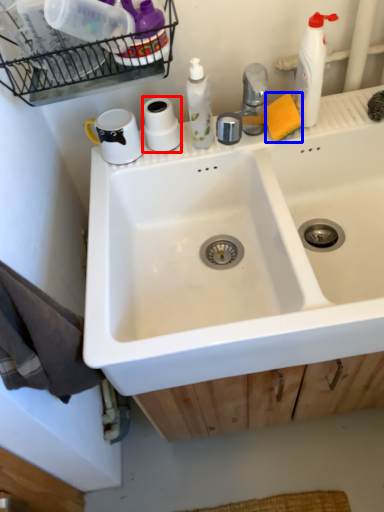
Question: Which object is closer to the camera taking this photo, toilet paper (highlighted by a red box) or soap (highlighted by a blue box)?

Choices:
 (A) toilet paper
 (B) soap

Answer: (B)